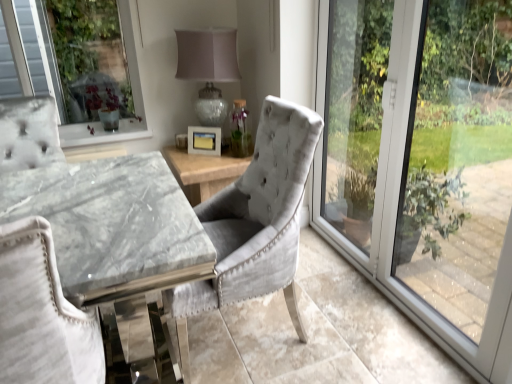
Locate an element on the screen. The image size is (512, 384). free spot to the right of velvet grey chair at center, placed as the 2th chair when sorted from left to right is located at coordinates (350, 324).